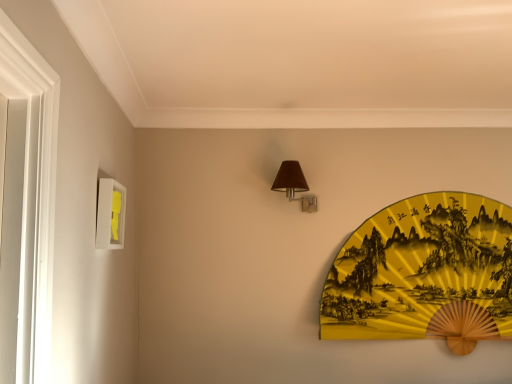
Question: In terms of size, does white matte picture frame at left appear bigger or smaller than yellow paper fan at upper right?

Choices:
 (A) small
 (B) big

Answer: (A)

Question: Is white matte picture frame at left taller or shorter than yellow paper fan at upper right?

Choices:
 (A) short
 (B) tall

Answer: (A)

Question: Considering the real-world distances, which object is closest to the white matte picture frame at left?

Choices:
 (A) matte brown fabric at upper center
 (B) yellow paper fan at upper right

Answer: (A)

Question: Based on their relative distances, which object is nearer to the yellow paper fan at upper right?

Choices:
 (A) white matte picture frame at left
 (B) matte brown fabric at upper center

Answer: (B)